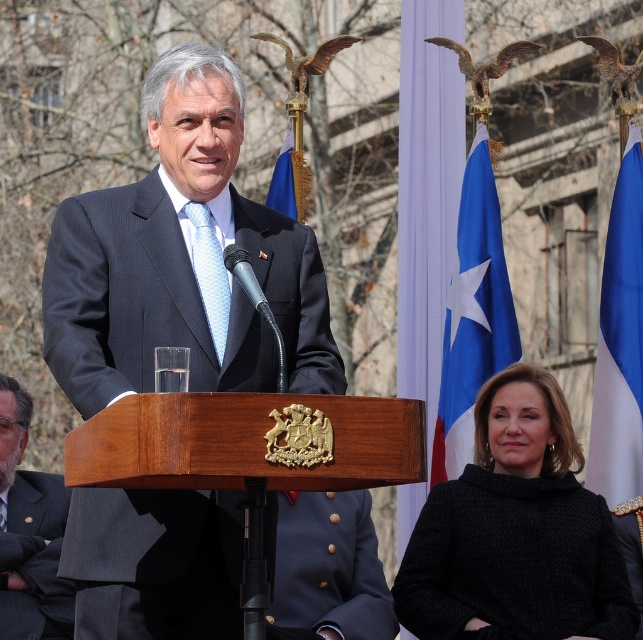
Question: Observing the image, what is the correct spatial positioning of blue fabric flag at right in reference to navy blue fabric at lower center?

Choices:
 (A) right
 (B) left

Answer: (A)

Question: Based on their relative distances, which object is farther from the blue fabric flag at upper center?

Choices:
 (A) navy blue fabric at lower center
 (B) blue fabric flag at right
 (C) dark blue suit at center
 (D) white fabric flag at right

Answer: (C)

Question: Is navy blue fabric at lower center smaller than dark gray suit at center?

Choices:
 (A) no
 (B) yes

Answer: (B)

Question: Among these objects, which one is nearest to the camera?

Choices:
 (A) navy blue fabric at lower center
 (B) blue fabric flag at right
 (C) blue fabric flag at upper center
 (D) light blue textured tie at center

Answer: (D)

Question: Can you confirm if black woolen sweater at lower right is positioned above dark gray suit at center?

Choices:
 (A) no
 (B) yes

Answer: (A)

Question: Among these points, which one is farthest from the camera?

Choices:
 (A) (192, 225)
 (B) (606, 394)

Answer: (B)